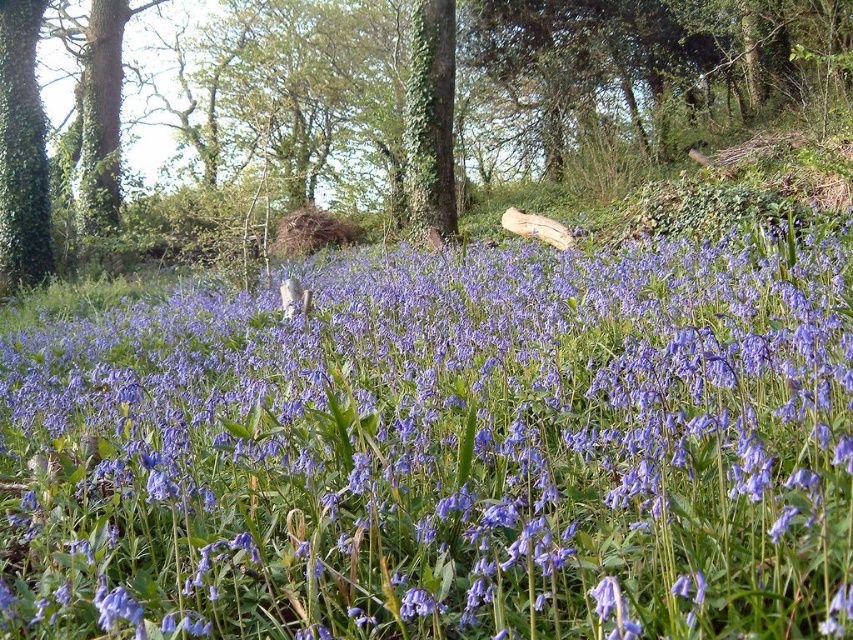
Between green ivy-covered tree at left and green ivy-covered tree at center, which one is positioned higher?

green ivy-covered tree at left

Based on the photo, is green ivy-covered tree at left taller than green ivy-covered tree at center?

Correct, green ivy-covered tree at left is much taller as green ivy-covered tree at center.

The image size is (853, 640). I want to click on green ivy-covered tree at left, so click(x=21, y=148).

Does purple matte flower at center appear over green ivy-covered tree at center?

No, purple matte flower at center is not above green ivy-covered tree at center.

This screenshot has width=853, height=640. What do you see at coordinates (445, 451) in the screenshot?
I see `purple matte flower at center` at bounding box center [445, 451].

This screenshot has width=853, height=640. I want to click on purple matte flower at center, so click(x=445, y=451).

Is green leafy tree at center to the right of green ivy-covered tree at center from the viewer's perspective?

No, green leafy tree at center is not to the right of green ivy-covered tree at center.

Who is positioned more to the right, green leafy tree at center or green ivy-covered tree at center?

green ivy-covered tree at center

The height and width of the screenshot is (640, 853). Identify the location of green leafy tree at center. (405, 115).